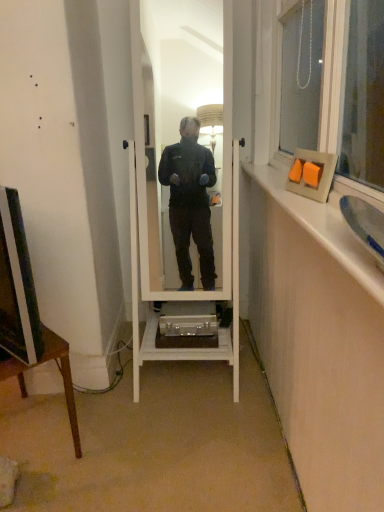
Question: Is matte black television at left further to camera compared to white wooden mirror at center?

Choices:
 (A) no
 (B) yes

Answer: (A)

Question: Can you confirm if matte black television at left is thinner than white wooden mirror at center?

Choices:
 (A) yes
 (B) no

Answer: (A)

Question: From a real-world perspective, is matte black television at left located higher than white wooden mirror at center?

Choices:
 (A) yes
 (B) no

Answer: (B)

Question: Is matte black television at left oriented away from white wooden mirror at center?

Choices:
 (A) no
 (B) yes

Answer: (B)

Question: Can you confirm if matte black television at left is shorter than white wooden mirror at center?

Choices:
 (A) no
 (B) yes

Answer: (B)

Question: Looking at their shapes, would you say matte orange picture frame at upper right is wider or thinner than white wooden mirror at center?

Choices:
 (A) wide
 (B) thin

Answer: (B)

Question: From the image's perspective, relative to white wooden mirror at center, is matte orange picture frame at upper right above or below?

Choices:
 (A) below
 (B) above

Answer: (B)

Question: From a real-world perspective, is matte orange picture frame at upper right above or below white wooden mirror at center?

Choices:
 (A) below
 (B) above

Answer: (B)

Question: Considering the positions of matte orange picture frame at upper right and white wooden mirror at center in the image, is matte orange picture frame at upper right bigger or smaller than white wooden mirror at center?

Choices:
 (A) big
 (B) small

Answer: (B)

Question: Does point (288, 182) appear closer or farther from the camera than point (21, 261)?

Choices:
 (A) farther
 (B) closer

Answer: (A)

Question: Relative to matte black television at left, is matte orange picture frame at upper right in front or behind?

Choices:
 (A) front
 (B) behind

Answer: (B)

Question: From a real-world perspective, is matte orange picture frame at upper right positioned above or below matte black television at left?

Choices:
 (A) below
 (B) above

Answer: (B)

Question: Would you say matte orange picture frame at upper right is inside or outside matte black television at left?

Choices:
 (A) outside
 (B) inside

Answer: (A)

Question: In terms of size, does matte black television at left appear bigger or smaller than wooden frame at upper right?

Choices:
 (A) big
 (B) small

Answer: (A)

Question: Relative to wooden frame at upper right, is matte black television at left in front or behind?

Choices:
 (A) behind
 (B) front

Answer: (A)